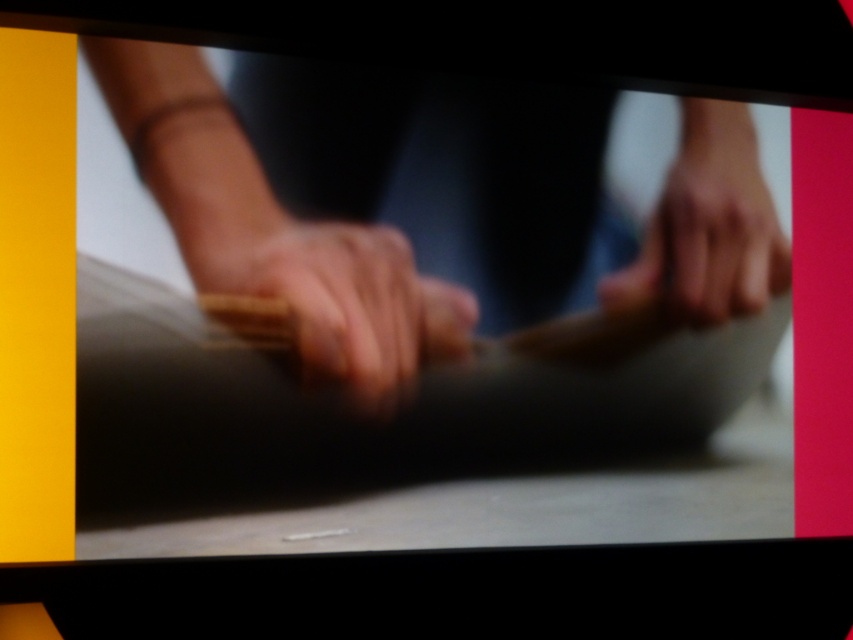
You are a tailor working on a project that requires precise measurements. You have a smooth beige fabric at center and a smooth wood drumstick at center in front of you. Can you fit both items side by side on a 10 cm wide workspace without overlapping?

The distance between the smooth beige fabric at center and the smooth wood drumstick at center is 4.25 centimeters. Since the total width needed would be 4.25 cm plus the width of both items, but the workspace is 10 cm wide, it depends on the individual widths of the fabric and drumstick. However, the given information only specifies the distance between them, not their sizes. Without knowing their dimensions, we cannot confirm if they fit within 10 cm.

You are an assistant helping someone locate an object in the image. The user asks, where is the smooth beige fabric at center? Please provide coordinates in the format of x,y between 0 and 1.

The smooth beige fabric at center is located at coordinates (274, 228).

You are a tailor trying to determine if the smooth beige fabric at center can fit entirely under your smooth skin hand at center while working on it. Based on the provided information, can you confirm if the fabric is wider than your hand?

The smooth beige fabric at center might be wider than smooth skin hand at center, so there is a possibility that the fabric is wider than your hand. However, without exact measurements, it is uncertain.